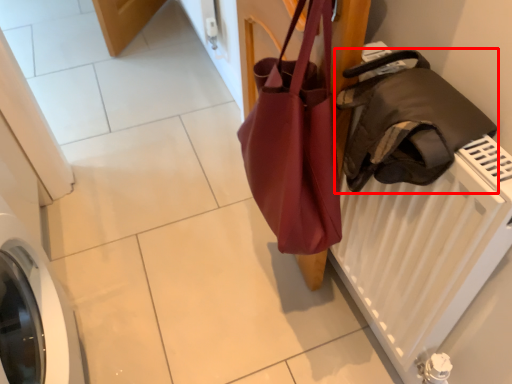
Question: Observing the image, what is the correct spatial positioning of luggage and bags (annotated by the red box) in reference to handbag?

Choices:
 (A) left
 (B) right

Answer: (B)